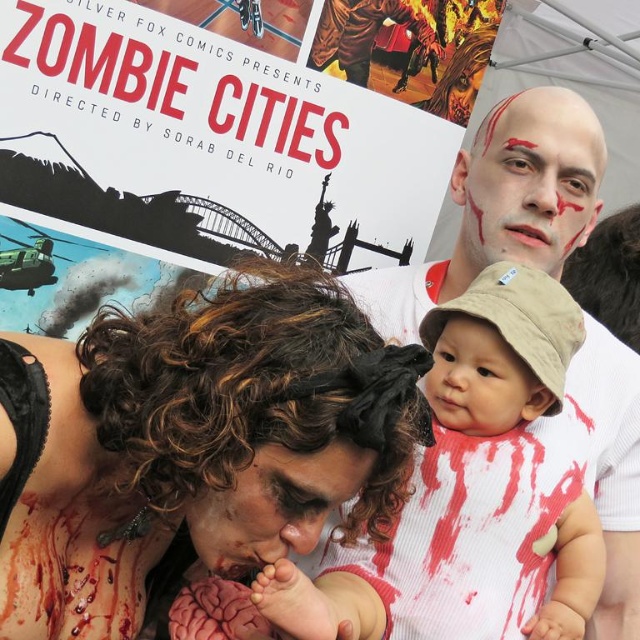
You are a photographer at the Zombie Cities event. You need to position the white ribbed onesie at center and the smooth beige hat at center so that they fit within a 2m wide frame. Can both items fit side by side without overlapping?

Answer: The white ribbed onesie at center might be wider than smooth beige hat at center, so it is uncertain if both can fit side by side within the 2m frame without overlapping. Measure their widths to confirm.

In the Zombie Cities poster, you notice two key elements in the foreground. One is the pale matte face at upper center and the other is the smooth beige hat at center. Which of these two items is located more to the right side?

The pale matte face at upper center is positioned on the right side of the smooth beige hat at center, so it is more to the right.